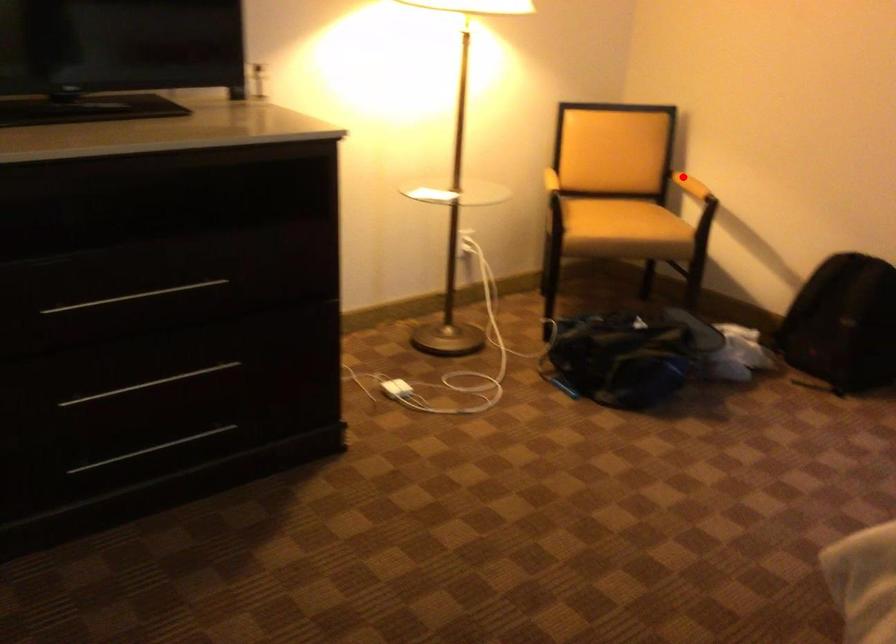
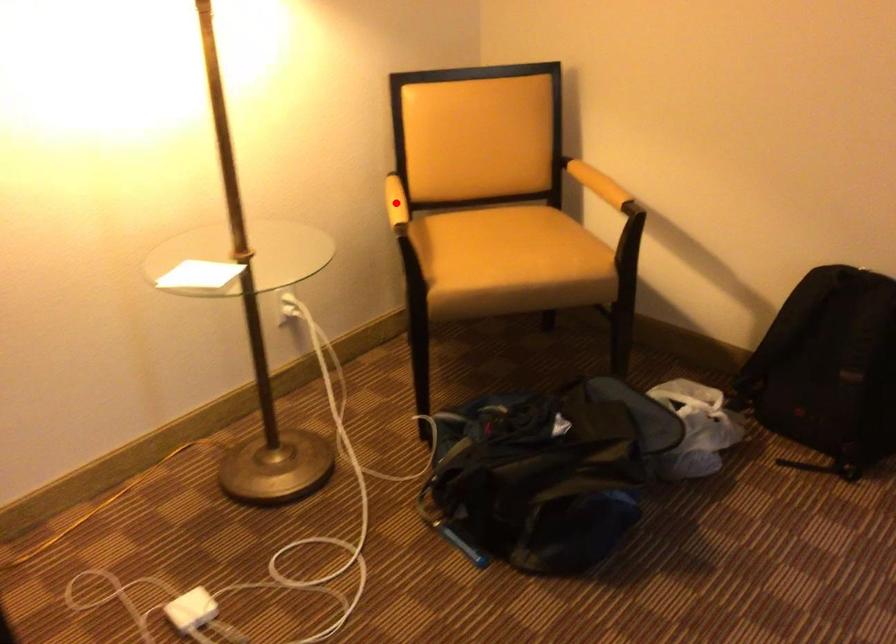
I am providing you with two images of the same scene from different viewpoints. A red point is marked on the first image and another point is marked on the second image. Is the red point in image1 aligned with the point shown in image2?

No